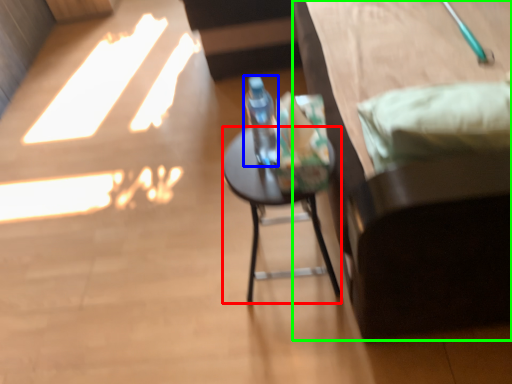
Question: Which is farther away from desk (highlighted by a red box)? bottle (highlighted by a blue box) or furniture (highlighted by a green box)?

Choices:
 (A) bottle
 (B) furniture

Answer: (B)